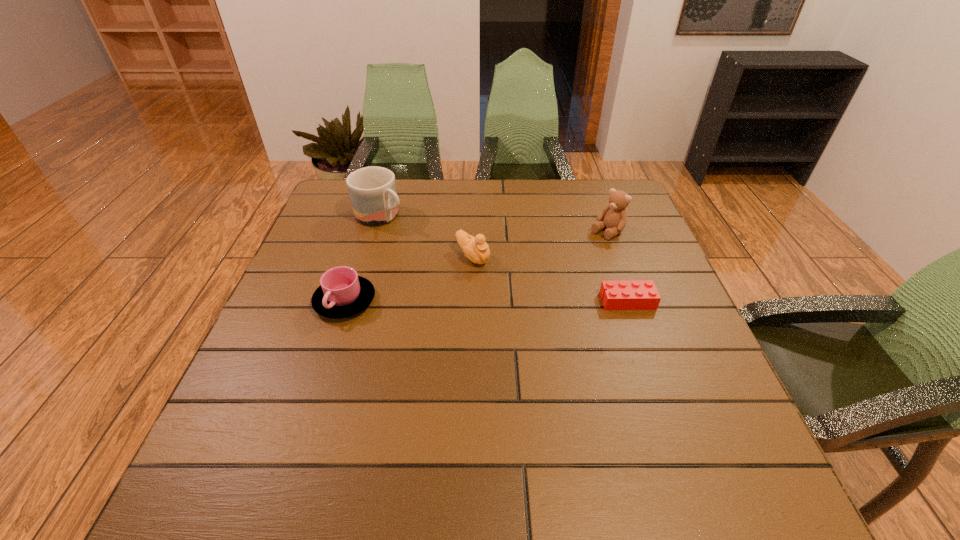
Find the location of a particular element. This screenshot has width=960, height=540. cup is located at coordinates (342, 293).

Identify the location of the shortest object. (623, 294).

Where is `teddy bear`? teddy bear is located at coordinates (614, 216).

Find the location of `the third shortest object`. the third shortest object is located at coordinates (476, 249).

Locate an element on the screen. the third object from left to right is located at coordinates (476, 249).

Where is `mug`? Image resolution: width=960 pixels, height=540 pixels. mug is located at coordinates (372, 190).

Locate an element on the screen. The width and height of the screenshot is (960, 540). vacant space positioned on the side with the handle of the cup is located at coordinates (308, 417).

You are a GUI agent. You are given a task and a screenshot of the screen. Output one action in this format:
    pyautogui.click(x=<x>, y=<y>)
    Task: Click on the vacant region located 0.230m on the left of the Lego
    
    Given the screenshot: What is the action you would take?
    pyautogui.click(x=504, y=301)

Locate an element on the screen. free space located on the face of the teddy bear is located at coordinates (567, 260).

Where is `vacant space located on the face of the teddy bear`? The height and width of the screenshot is (540, 960). vacant space located on the face of the teddy bear is located at coordinates (531, 285).